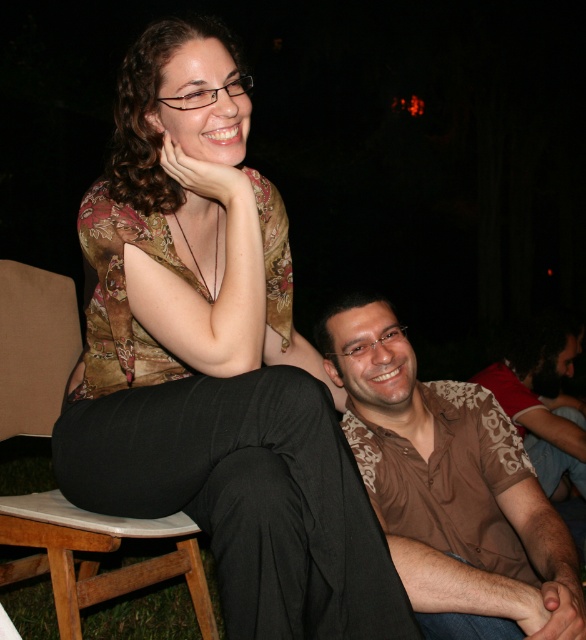
Is brown printed shirt at center shorter than brown patterned shirt at lower right?

Correct, brown printed shirt at center is not as tall as brown patterned shirt at lower right.

Does brown printed shirt at center have a greater height compared to brown patterned shirt at lower right?

No, brown printed shirt at center is not taller than brown patterned shirt at lower right.

Does point (410, 452) lie in front of point (526, 344)?

Yes.

Locate an element on the screen. This screenshot has width=586, height=640. brown printed shirt at center is located at coordinates (451, 488).

Does floral-patterned blouse at upper center appear on the right side of wooden at left?

Yes, floral-patterned blouse at upper center is to the right of wooden at left.

Does floral-patterned blouse at upper center have a greater height compared to wooden at left?

In fact, floral-patterned blouse at upper center may be shorter than wooden at left.

Does point (86, 449) come behind point (114, 577)?

No, (86, 449) is closer to viewer.

The height and width of the screenshot is (640, 586). What are the coordinates of `floral-patterned blouse at upper center` in the screenshot? It's located at (214, 360).

Between brown printed shirt at center and wooden at left, which one is positioned higher?

Positioned higher is brown printed shirt at center.

Is brown printed shirt at center positioned in front of wooden at left?

Yes, brown printed shirt at center is closer to the viewer.

From the picture: Who is more distant from viewer, (x=539, y=588) or (x=118, y=531)?

Point (x=118, y=531)

The width and height of the screenshot is (586, 640). In order to click on brown printed shirt at center in this screenshot , I will do `click(451, 488)`.